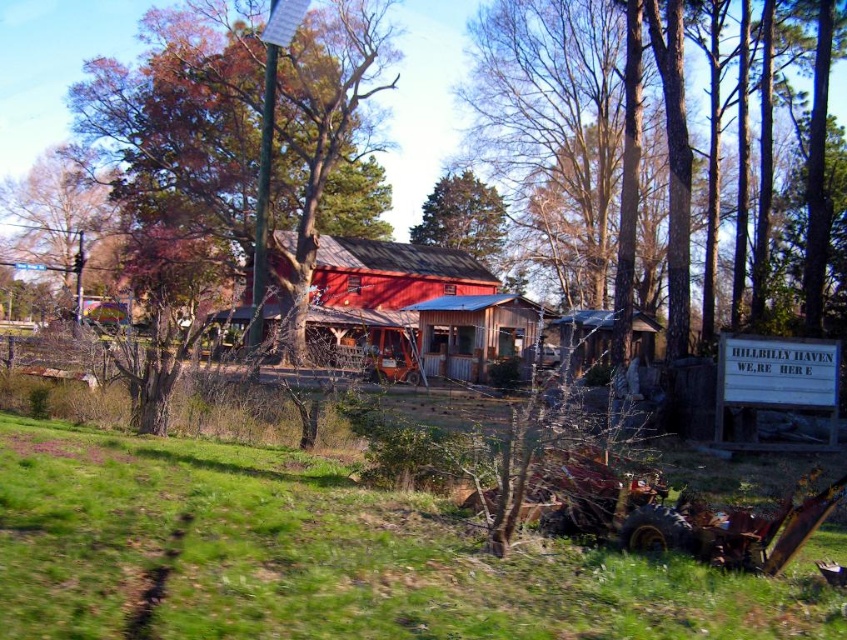
Is smooth bark tree at center closer to camera compared to rustic wood cabin at center?

Yes.

Who is lower down, smooth bark tree at center or rustic wood cabin at center?

rustic wood cabin at center is lower down.

You are a GUI agent. You are given a task and a screenshot of the screen. Output one action in this format:
    pyautogui.click(x=<x>, y=<y>)
    Task: Click on the smooth bark tree at center
    The image size is (847, 640).
    Given the screenshot: What is the action you would take?
    pyautogui.click(x=551, y=122)

Between rustic wood cabin at center and green textured pine tree at upper center, which one is positioned higher?

green textured pine tree at upper center is above.

Who is lower down, rustic wood cabin at center or green textured pine tree at upper center?

Positioned lower is rustic wood cabin at center.

Is point (425, 244) farther from viewer compared to point (499, 196)?

No, it is in front of (499, 196).

Where is `rustic wood cabin at center`? rustic wood cabin at center is located at coordinates (385, 282).

Is brown textured tree at upper left further to the viewer compared to green textured pine tree at upper center?

No.

Does point (40, 170) come closer to viewer compared to point (485, 193)?

No, (40, 170) is further to viewer.

Find the location of a particular element. This screenshot has width=847, height=640. brown textured tree at upper left is located at coordinates (54, 212).